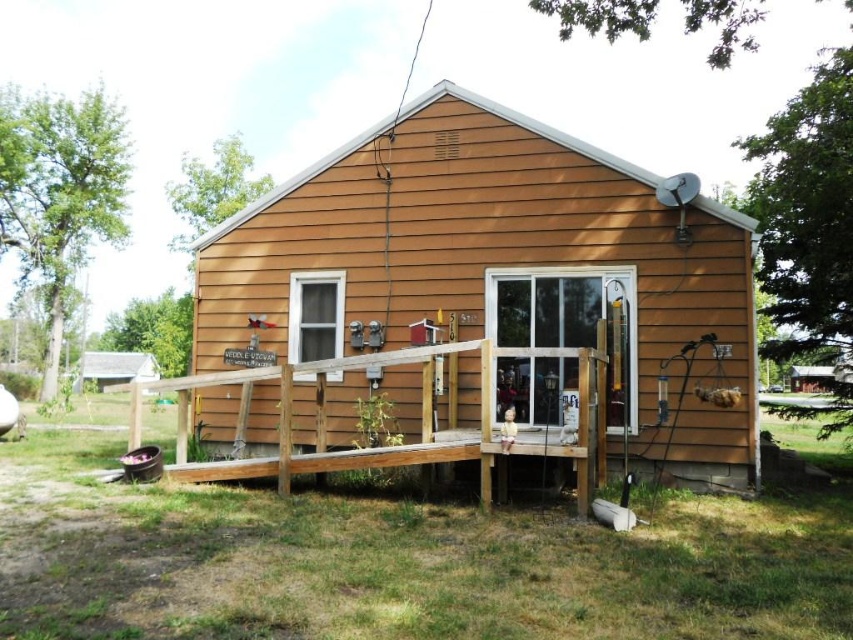
You are planning to paint the exterior of the house. You have a limited amount of paint that can cover an area of 10 square meters. The brown wood siding at center and the brown wooden porch at center need painting. Which area should you prioritize to ensure the paint lasts longer?

The brown wood siding at center has a lesser width compared to the brown wooden porch at center, so it requires less paint. Prioritizing the brown wood siding at center will allow the limited paint to cover it completely before moving on to the wider brown wooden porch at center.

You are standing in front of the wooden house and want to place a small potted plant between the two points marked as point (495,257) and point (190,388). Which point should the plant be closer to in order to be nearer to the viewer?

The plant should be placed closer to point (495,257) because it is closer to the viewer than point (190,388).